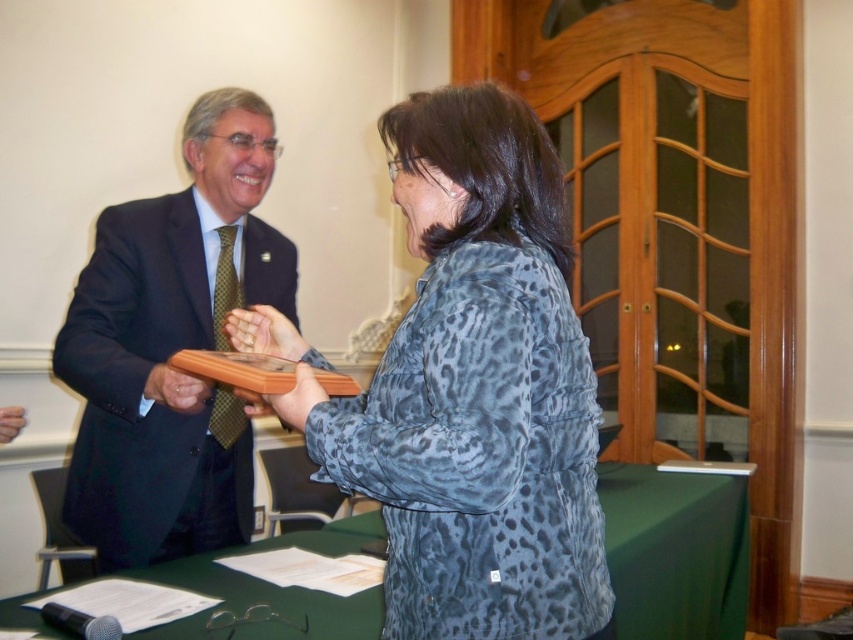
Can you confirm if leopard print jacket at center is positioned above green fabric table at center?

Yes, leopard print jacket at center is above green fabric table at center.

Is leopard print jacket at center below green fabric table at center?

Incorrect, leopard print jacket at center is not positioned below green fabric table at center.

Is point (524, 513) positioned before point (219, 573)?

Yes.

You are a GUI agent. You are given a task and a screenshot of the screen. Output one action in this format:
    pyautogui.click(x=<x>, y=<y>)
    Task: Click on the leopard print jacket at center
    The image size is (853, 640).
    Given the screenshot: What is the action you would take?
    pyautogui.click(x=476, y=388)

Is leopard print jacket at center to the left of matte black suit at left from the viewer's perspective?

In fact, leopard print jacket at center is to the right of matte black suit at left.

Find the location of a particular element. The image size is (853, 640). leopard print jacket at center is located at coordinates (476, 388).

Identify the location of leopard print jacket at center. The width and height of the screenshot is (853, 640). [476, 388].

Is matte black suit at left positioned at the back of green fabric table at center?

No, it is in front of green fabric table at center.

Does matte black suit at left have a lesser height compared to green fabric table at center?

No, matte black suit at left is not shorter than green fabric table at center.

Image resolution: width=853 pixels, height=640 pixels. Describe the element at coordinates (172, 346) in the screenshot. I see `matte black suit at left` at that location.

What are the coordinates of `matte black suit at left` in the screenshot? It's located at (172, 346).